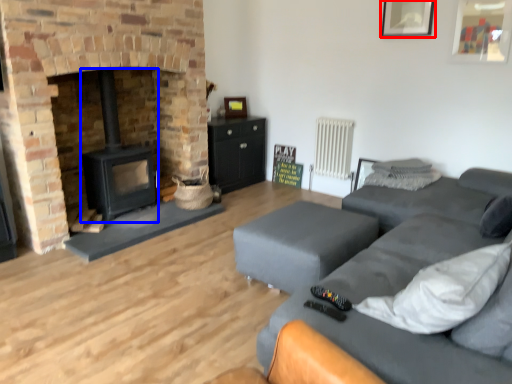
Question: Which of the following is the farthest to the observer, picture frame (highlighted by a red box) or wood burning stove (highlighted by a blue box)?

Choices:
 (A) picture frame
 (B) wood burning stove

Answer: (A)